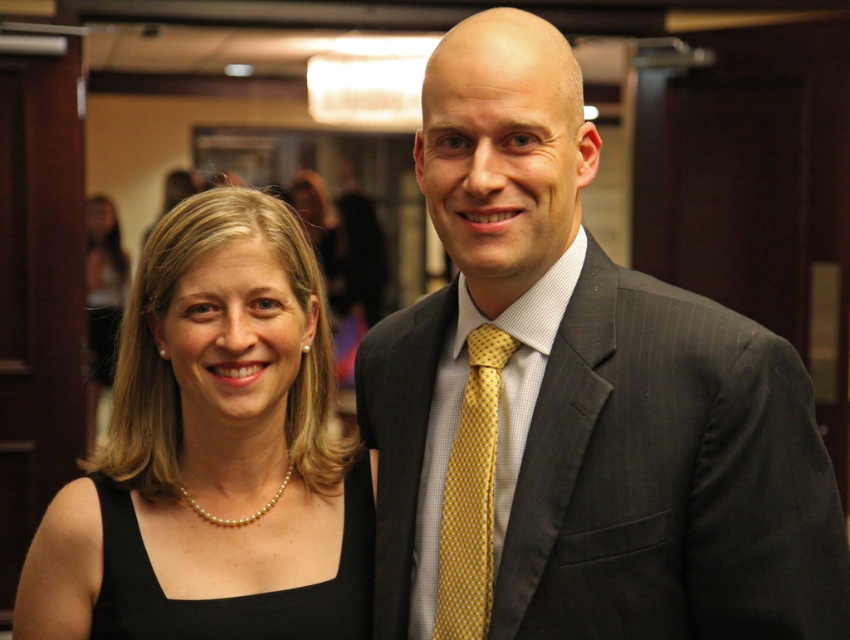
Question: Can you confirm if black pearl necklace at lower left is positioned below yellow dotted tie at center?

Choices:
 (A) yes
 (B) no

Answer: (A)

Question: Which point is closer to the camera?

Choices:
 (A) matte gray suit at center
 (B) pearl necklace at upper left

Answer: (A)

Question: Which point is farther to the camera?

Choices:
 (A) pearl necklace at upper left
 (B) yellow dotted tie at center

Answer: (A)

Question: Where is black satin dress at center located in relation to pearl necklace at upper left in the image?

Choices:
 (A) above
 (B) below

Answer: (B)

Question: Is matte gray suit at center below pearl necklace at upper left?

Choices:
 (A) yes
 (B) no

Answer: (A)

Question: Which object is closer to the camera taking this photo?

Choices:
 (A) yellow dotted tie at center
 (B) black pearl necklace at lower left
 (C) black satin dress at center

Answer: (A)